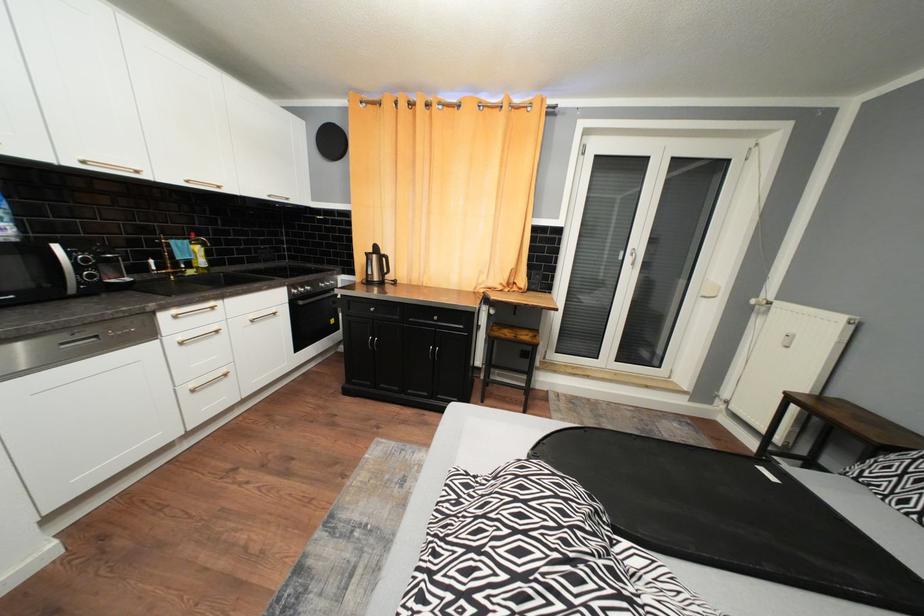
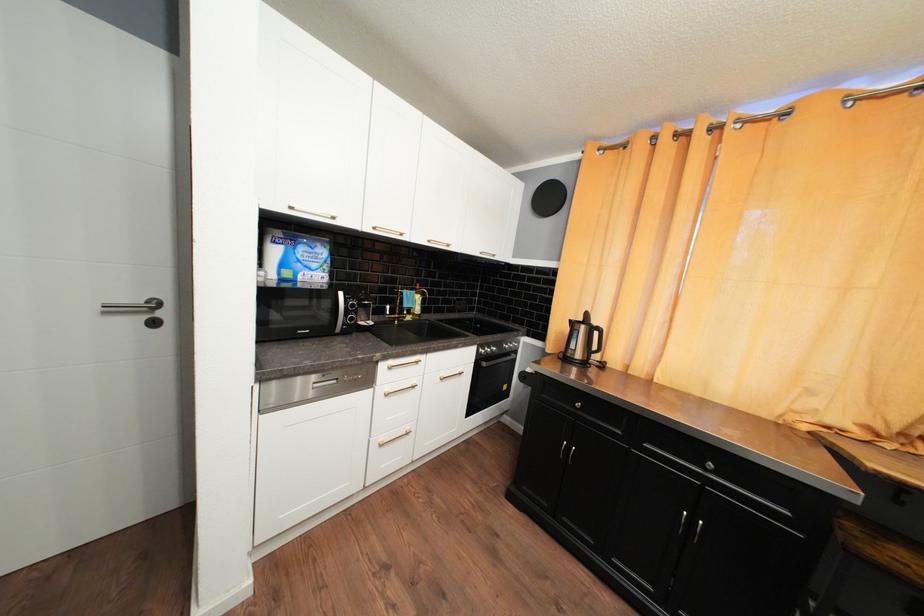
Question: The first image is from the beginning of the video and the second image is from the end. How did the camera likely rotate when shooting the video?

Choices:
 (A) Left
 (B) Right
 (C) Up
 (D) Down

Answer: (A)